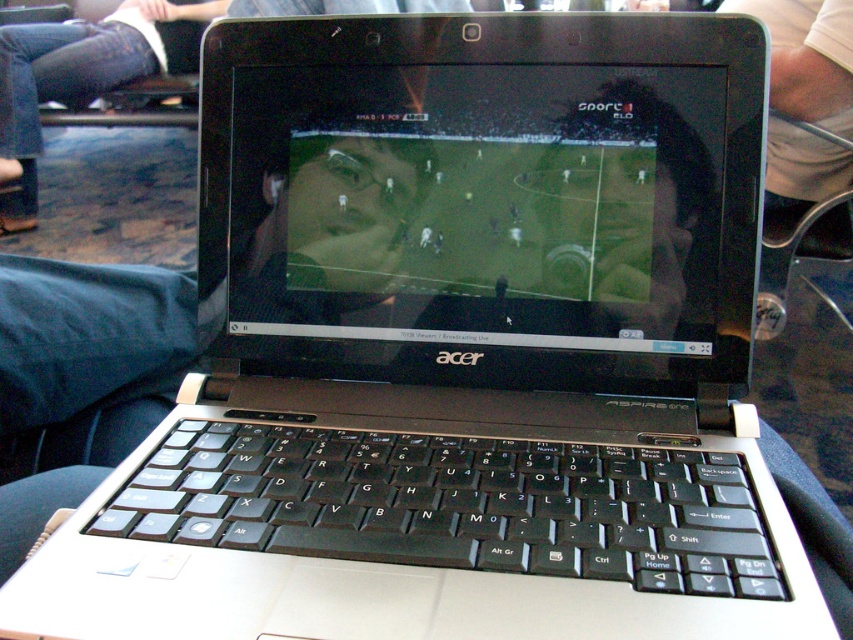
Question: Which object appears farthest from the camera in this image?

Choices:
 (A) matte black laptop at center
 (B) blue jeans at lower left

Answer: (B)

Question: Does matte black laptop at center have a lesser width compared to blue jeans at lower left?

Choices:
 (A) no
 (B) yes

Answer: (B)

Question: Where is matte black laptop at center located in relation to blue jeans at lower left in the image?

Choices:
 (A) above
 (B) below

Answer: (B)

Question: Is matte black laptop at center to the left of blue jeans at lower left from the viewer's perspective?

Choices:
 (A) yes
 (B) no

Answer: (B)